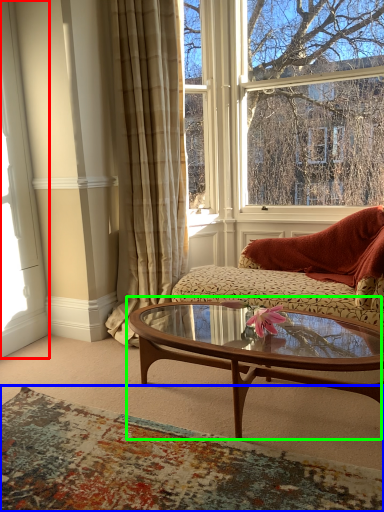
Question: Considering the real-world distances, which object is farthest from window frame (highlighted by a red box)? plain (highlighted by a blue box) or coffee table (highlighted by a green box)?

Choices:
 (A) plain
 (B) coffee table

Answer: (B)